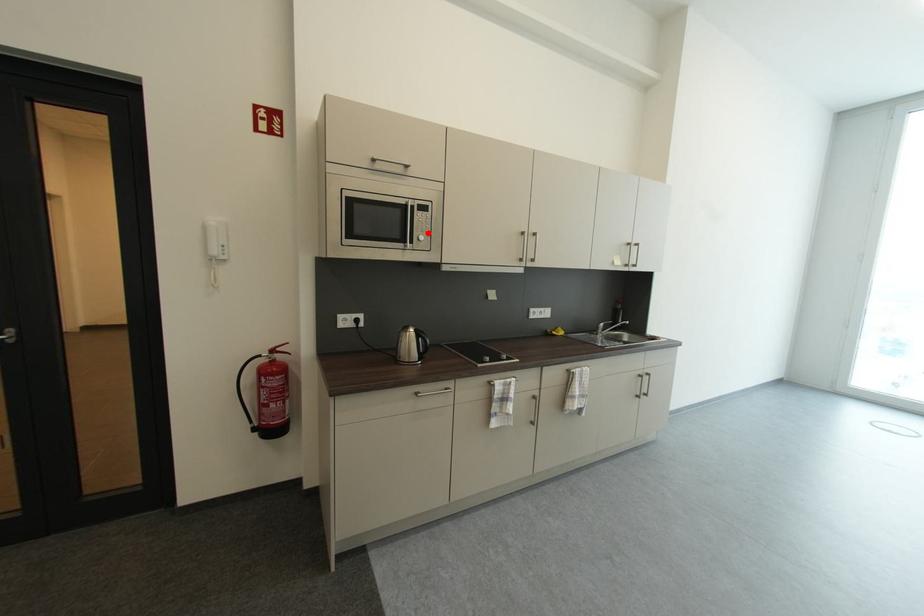
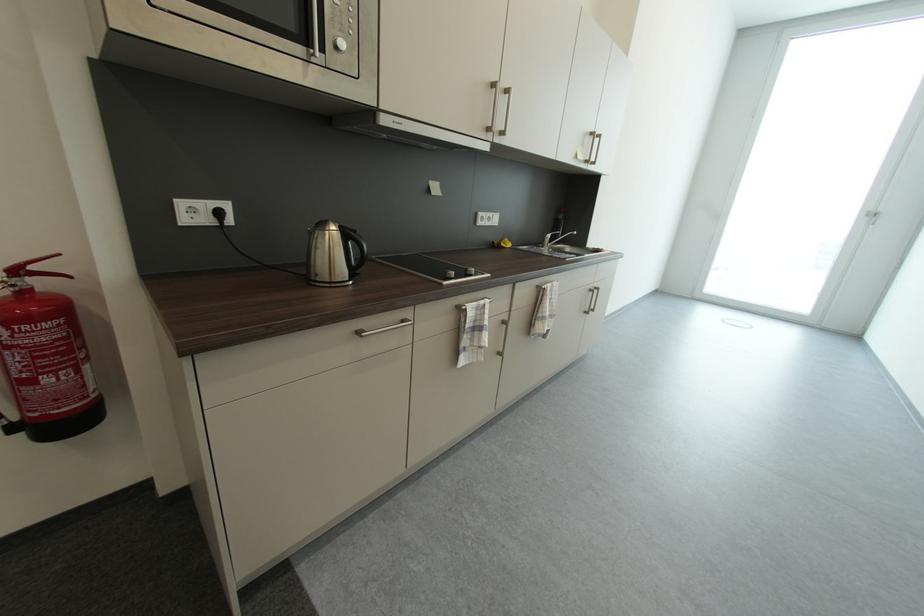
The point at the highlighted location is marked in the first image. Where is the corresponding point in the second image?

(347, 33)